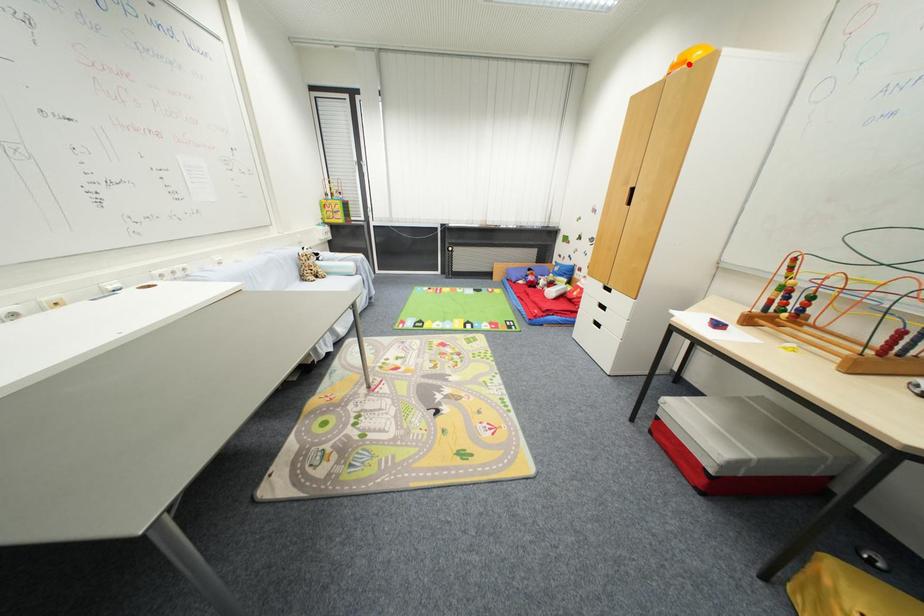
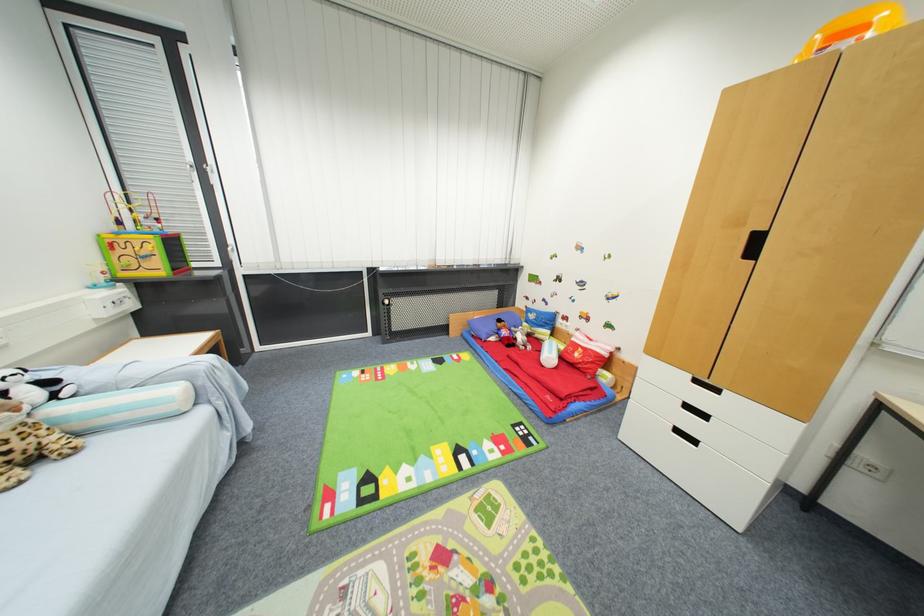
Locate, in the second image, the point that corresponds to the highlighted location in the first image.

(868, 30)